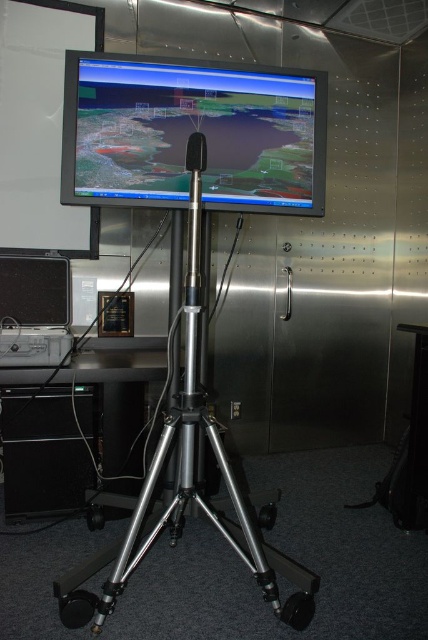
Question: Which point is farther to the camera?

Choices:
 (A) silver metallic tripod at center
 (B) black plastic speaker at lower left

Answer: (B)

Question: Which object is positioned farthest from the black plastic computer at lower left?

Choices:
 (A) black plastic speaker at lower left
 (B) silver metallic tripod at center
 (C) black plastic computer desk at lower left
 (D) matte black monitor at center

Answer: (D)

Question: Is black plastic computer desk at lower left positioned before silver metallic tripod at center?

Choices:
 (A) no
 (B) yes

Answer: (A)

Question: Is black plastic computer desk at lower left positioned in front of black plastic computer at lower left?

Choices:
 (A) no
 (B) yes

Answer: (B)

Question: Which point is closer to the camera?

Choices:
 (A) silver metallic tripod at center
 (B) matte black monitor at center
 (C) black plastic speaker at lower left
 (D) black plastic computer at lower left

Answer: (A)

Question: Does matte black monitor at center appear over black plastic speaker at lower left?

Choices:
 (A) no
 (B) yes

Answer: (B)